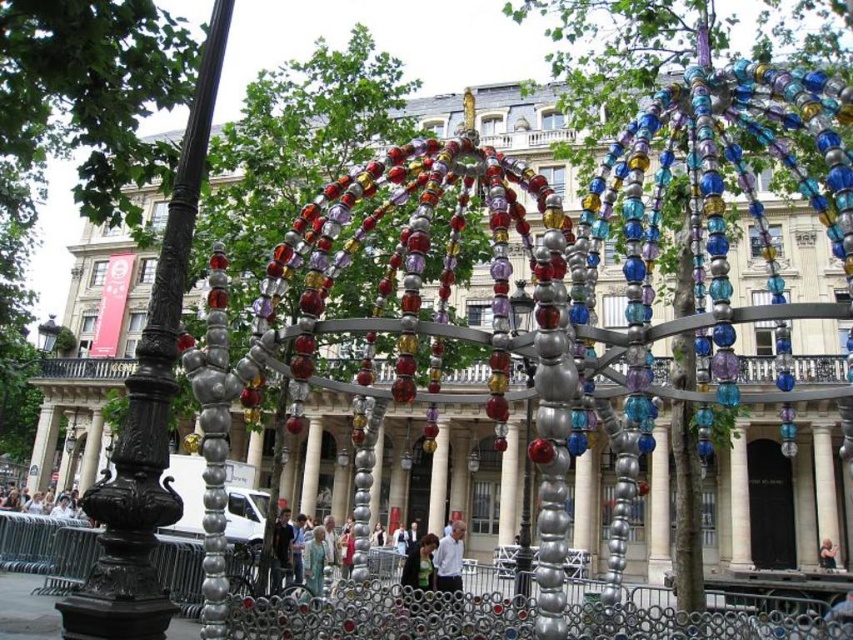
Is black metal pole at left positioned behind light beige fabric coat at center?

That is False.

Is point (177, 250) positioned in front of point (306, 570)?

That is True.

This screenshot has width=853, height=640. I want to click on black metal pole at left, so click(148, 408).

Can you confirm if green fabric dress at center is positioned to the right of light beige fabric coat at center?

Yes, green fabric dress at center is to the right of light beige fabric coat at center.

Is point (421, 588) farther from viewer compared to point (318, 589)?

No, it is not.

Who is more forward, (415, 561) or (323, 529)?

Point (415, 561) is more forward.

Locate an element on the screen. The image size is (853, 640). green fabric dress at center is located at coordinates (418, 568).

From the picture: Between light beige fabric coat at center and white shirt at lower left, which one appears on the left side from the viewer's perspective?

From the viewer's perspective, white shirt at lower left appears more on the left side.

Between light beige fabric coat at center and white shirt at lower left, which one appears on the right side from the viewer's perspective?

light beige fabric coat at center

You are a GUI agent. You are given a task and a screenshot of the screen. Output one action in this format:
    pyautogui.click(x=<x>, y=<y>)
    Task: Click on the light beige fabric coat at center
    
    Given the screenshot: What is the action you would take?
    pyautogui.click(x=314, y=561)

You are a GUI agent. You are given a task and a screenshot of the screen. Output one action in this format:
    pyautogui.click(x=<x>, y=<y>)
    Task: Click on the light beige fabric coat at center
    This screenshot has width=853, height=640.
    Given the screenshot: What is the action you would take?
    pyautogui.click(x=314, y=561)